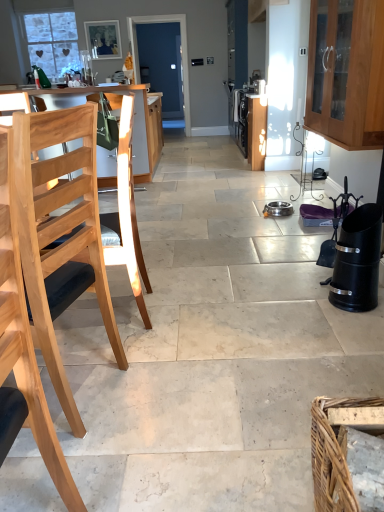
Question: Is wooden cabinet at upper right, acting as the second cabinetry starting from the left, bigger than wooden chair at left, the second cabinetry when ordered from right to left?

Choices:
 (A) yes
 (B) no

Answer: (A)

Question: Can you confirm if wooden cabinet at upper right, positioned as the 1th cabinetry in right-to-left order, is wider than wooden chair at left, the 1th cabinetry in the left-to-right sequence?

Choices:
 (A) no
 (B) yes

Answer: (A)

Question: Is wooden cabinet at upper right, positioned as the 1th cabinetry in right-to-left order, at the left side of wooden chair at left, positioned as the first cabinetry in back-to-front order?

Choices:
 (A) yes
 (B) no

Answer: (B)

Question: Is wooden cabinet at upper right, which appears as the first cabinetry when viewed from the front, facing towards wooden chair at left, marked as the second cabinetry in a front-to-back arrangement?

Choices:
 (A) no
 (B) yes

Answer: (A)

Question: From a real-world perspective, is wooden cabinet at upper right, positioned as the 1th cabinetry in right-to-left order, located higher than wooden chair at left, the second cabinetry when ordered from right to left?

Choices:
 (A) yes
 (B) no

Answer: (A)

Question: Does wooden cabinet at upper right, which appears as the first cabinetry when viewed from the front, lie behind wooden chair at left, the 1th cabinetry in the left-to-right sequence?

Choices:
 (A) no
 (B) yes

Answer: (A)

Question: Is wooden chair at left, the second cabinetry when ordered from right to left, at the back of light wood table at left?

Choices:
 (A) yes
 (B) no

Answer: (A)

Question: Considering the relative positions of light wood table at left and wooden chair at left, positioned as the first cabinetry in back-to-front order, in the image provided, is light wood table at left to the right of wooden chair at left, positioned as the first cabinetry in back-to-front order, from the viewer's perspective?

Choices:
 (A) no
 (B) yes

Answer: (A)

Question: Can you confirm if light wood table at left is taller than wooden chair at left, marked as the second cabinetry in a front-to-back arrangement?

Choices:
 (A) no
 (B) yes

Answer: (B)

Question: From a real-world perspective, is light wood table at left below wooden chair at left, the second cabinetry when ordered from right to left?

Choices:
 (A) yes
 (B) no

Answer: (B)

Question: From a real-world perspective, is light wood table at left on top of wooden chair at left, the 1th cabinetry in the left-to-right sequence?

Choices:
 (A) yes
 (B) no

Answer: (A)

Question: From the image's perspective, is light wood table at left under wooden chair at left, marked as the second cabinetry in a front-to-back arrangement?

Choices:
 (A) no
 (B) yes

Answer: (A)

Question: Considering the relative sizes of white frosted glass window at upper left and brown woven basket at lower right in the image provided, is white frosted glass window at upper left smaller than brown woven basket at lower right?

Choices:
 (A) no
 (B) yes

Answer: (A)